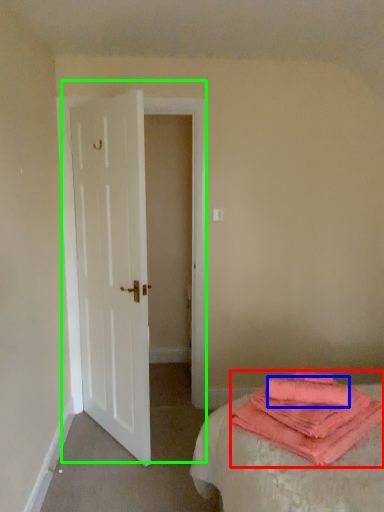
Question: Considering the real-world distances, which object is closest to cloth (highlighted by a red box)? beach towel (highlighted by a blue box) or door (highlighted by a green box).

Choices:
 (A) beach towel
 (B) door

Answer: (A)